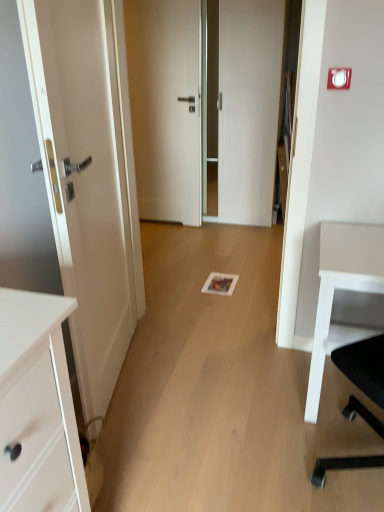
Identify the location of vacant space to the right of white glossy door at left, the 3th door from the back. This screenshot has width=384, height=512. (204, 380).